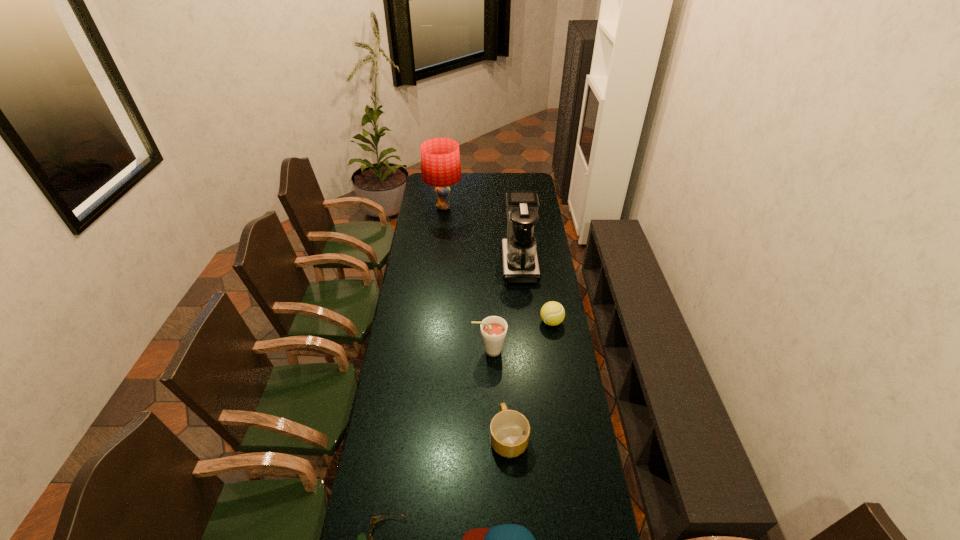
In order to click on vacant position located 0.080m on the drink side of the fourth nearest object in this screenshot , I will do `click(452, 350)`.

This screenshot has width=960, height=540. Identify the location of vacant space positioned 0.160m on the drink side of the fourth nearest object. (433, 350).

Where is `free space located 0.270m on the drink side of the fourth nearest object`? This screenshot has height=540, width=960. free space located 0.270m on the drink side of the fourth nearest object is located at coordinates (406, 350).

Locate an element on the screen. The width and height of the screenshot is (960, 540). blank space located on the left of the tennis ball is located at coordinates (507, 322).

You are a GUI agent. You are given a task and a screenshot of the screen. Output one action in this format:
    pyautogui.click(x=<x>, y=<y>)
    Task: Click on the free spot located on the side with the handle of the fifth farthest object
    The height and width of the screenshot is (540, 960).
    Given the screenshot: What is the action you would take?
    pyautogui.click(x=504, y=350)

Locate an element on the screen. Image resolution: width=960 pixels, height=540 pixels. vacant space situated 0.380m on the side with the handle of the fifth farthest object is located at coordinates (503, 334).

The width and height of the screenshot is (960, 540). In order to click on vacant space located on the side with the handle of the fifth farthest object in this screenshot , I will do `click(503, 332)`.

The image size is (960, 540). I want to click on object that is at the left edge, so click(440, 159).

The image size is (960, 540). What are the coordinates of `coffee maker that is at the right edge` in the screenshot? It's located at (519, 255).

You are a GUI agent. You are given a task and a screenshot of the screen. Output one action in this format:
    pyautogui.click(x=<x>, y=<y>)
    Task: Click on the tennis ball positioned at the right edge
    The height and width of the screenshot is (540, 960).
    Given the screenshot: What is the action you would take?
    pyautogui.click(x=552, y=313)